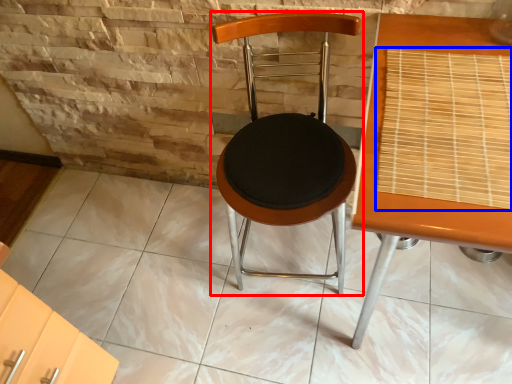
Question: Which object appears farthest to the camera in this image, chair (highlighted by a red box) or mat (highlighted by a blue box)?

Choices:
 (A) chair
 (B) mat

Answer: (A)